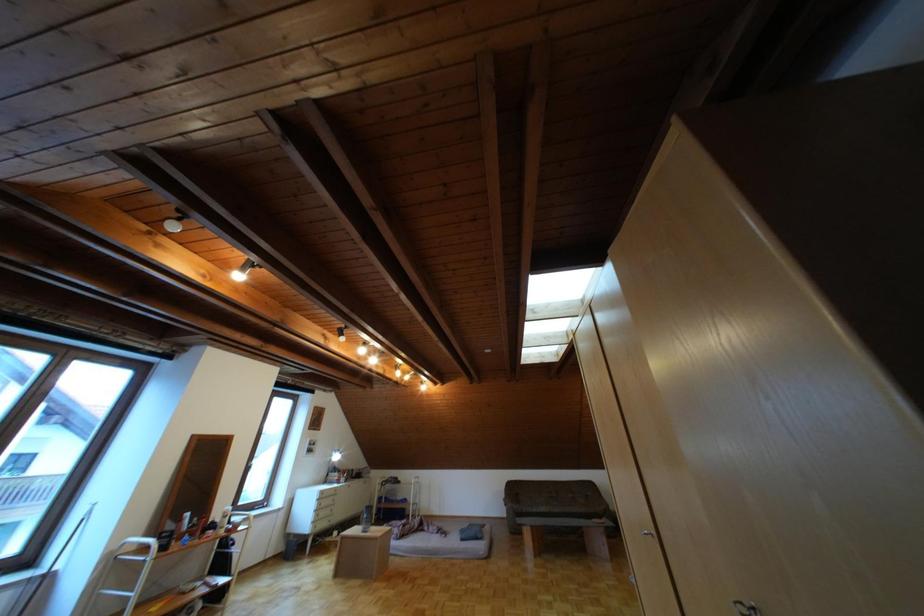
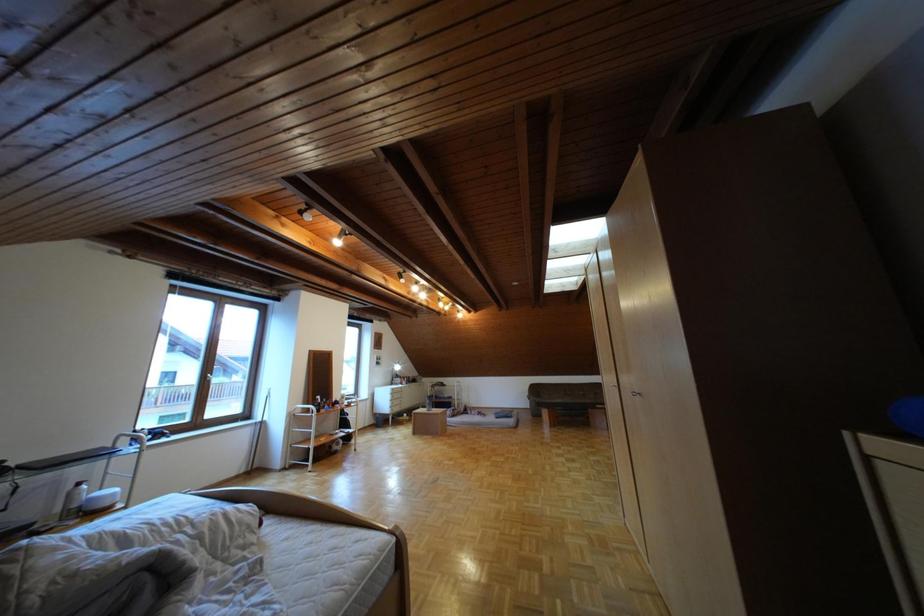
Question: The first image is from the beginning of the video and the second image is from the end. How did the camera likely rotate when shooting the video?

Choices:
 (A) Left
 (B) Right
 (C) Up
 (D) Down

Answer: (D)